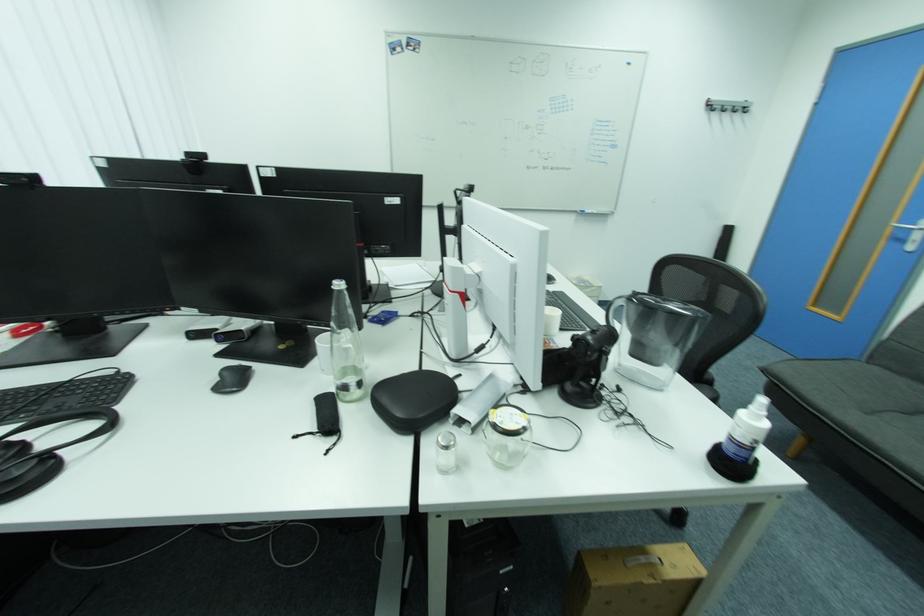
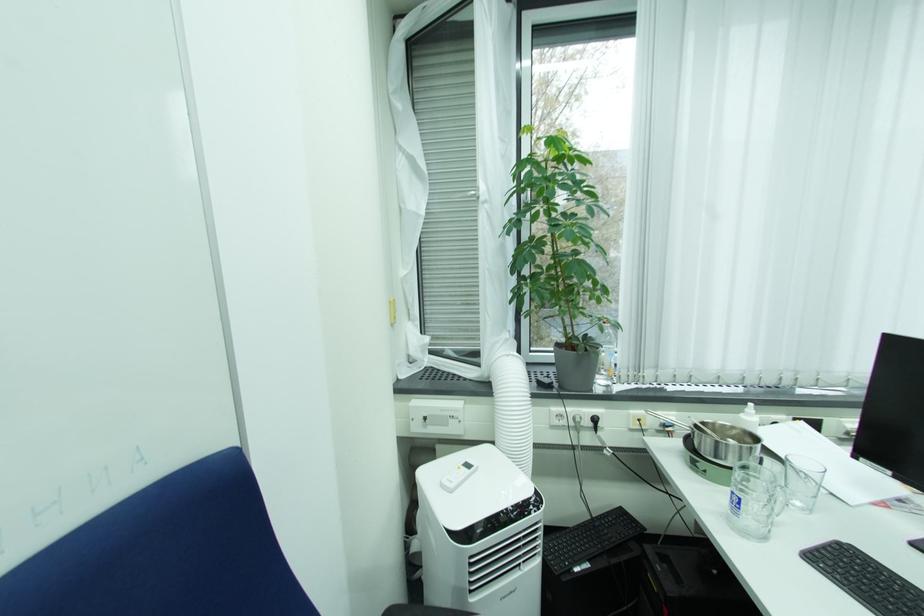
Question: The camera is either moving clockwise (left) or counter-clockwise (right) around the object. The first image is from the beginning of the video and the second image is from the end. Is the camera moving left or right when shooting the video?

Choices:
 (A) Left
 (B) Right

Answer: (B)